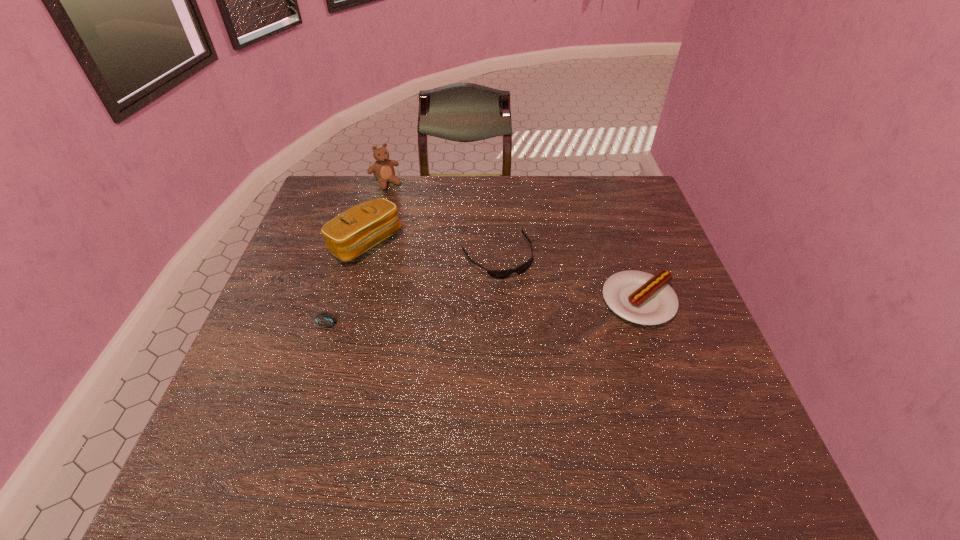
This screenshot has width=960, height=540. What are the coordinates of `the shortest object` in the screenshot? It's located at (325, 319).

Locate an element on the screen. the rightmost object is located at coordinates (639, 297).

Find the location of a particular element. The height and width of the screenshot is (540, 960). the third tallest object is located at coordinates (639, 297).

At what (x,y) coordinates should I click in order to perform the action: click on the second tallest object. Please return your answer as a coordinate pair (x, y). The height and width of the screenshot is (540, 960). Looking at the image, I should click on (360, 228).

Locate an element on the screen. teddy bear is located at coordinates (383, 169).

You are a GUI agent. You are given a task and a screenshot of the screen. Output one action in this format:
    pyautogui.click(x=<x>, y=<y>)
    Task: Click on the farthest object
    Image resolution: width=960 pixels, height=540 pixels.
    Given the screenshot: What is the action you would take?
    pyautogui.click(x=383, y=169)

At what (x,y) coordinates should I click in order to perform the action: click on sunglasses. Please return your answer as a coordinate pair (x, y). The width and height of the screenshot is (960, 540). Looking at the image, I should click on (498, 274).

The image size is (960, 540). I want to click on the second object from right to left, so click(498, 274).

Image resolution: width=960 pixels, height=540 pixels. I want to click on blank space located on the right of the shortest object, so [480, 327].

Locate an element on the screen. Image resolution: width=960 pixels, height=540 pixels. free spot located on the left of the third shortest object is located at coordinates (530, 301).